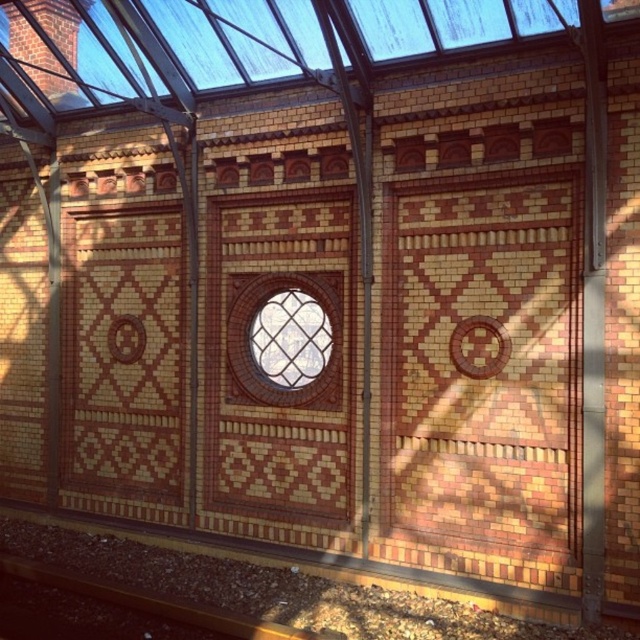
Question: Among these objects, which one is nearest to the camera?

Choices:
 (A) brown gravel at bottom
 (B) clear glass window at center

Answer: (A)

Question: Is clear glass window at center to the right of brown gravel at bottom from the viewer's perspective?

Choices:
 (A) no
 (B) yes

Answer: (B)

Question: Does clear glass window at center have a larger size compared to brown gravel at bottom?

Choices:
 (A) yes
 (B) no

Answer: (A)

Question: Is clear glass window at center closer to the viewer compared to brown gravel at bottom?

Choices:
 (A) yes
 (B) no

Answer: (B)

Question: Which point appears farthest from the camera in this image?

Choices:
 (A) (237, 630)
 (B) (333, 273)

Answer: (B)